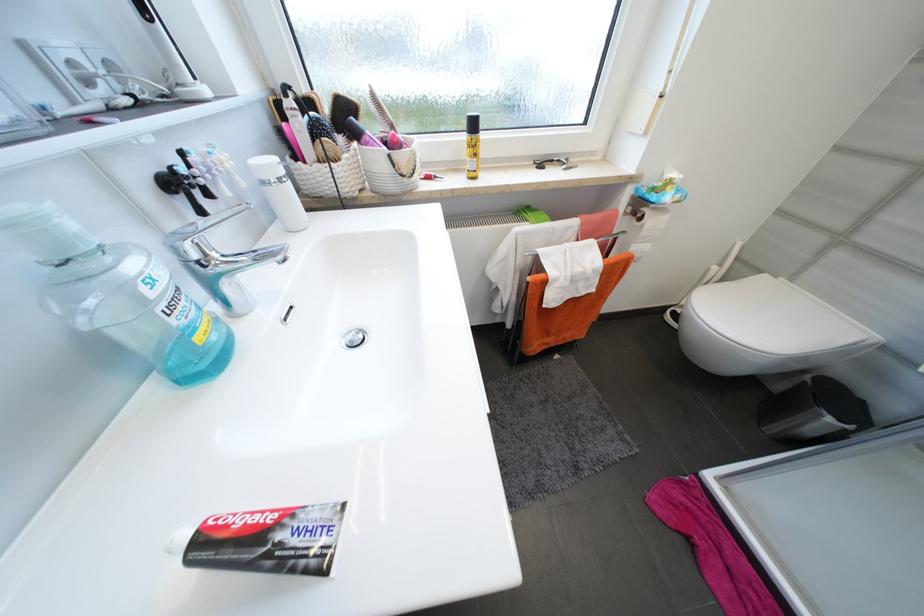
Locate an element on the screen. This screenshot has height=616, width=924. electric toothbrush is located at coordinates (293, 140).